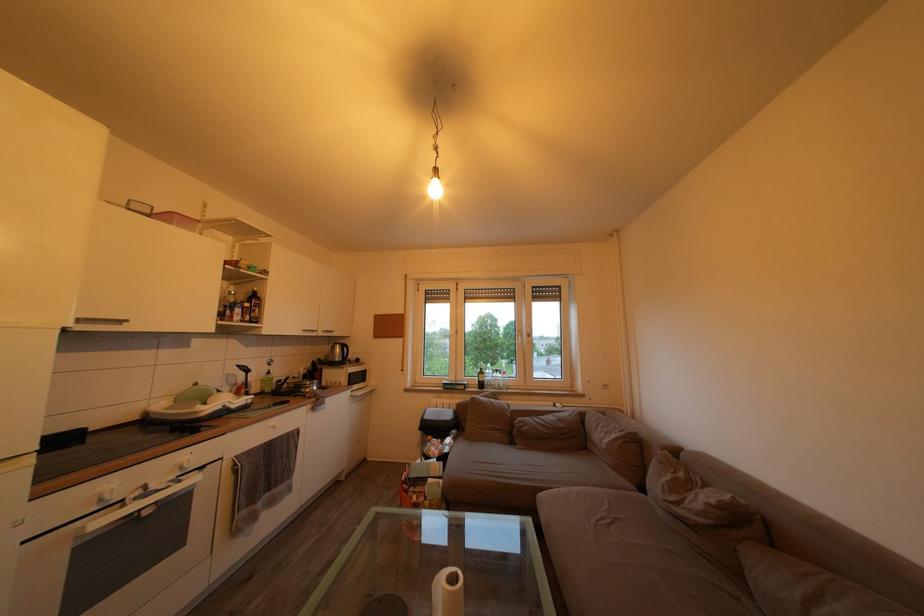
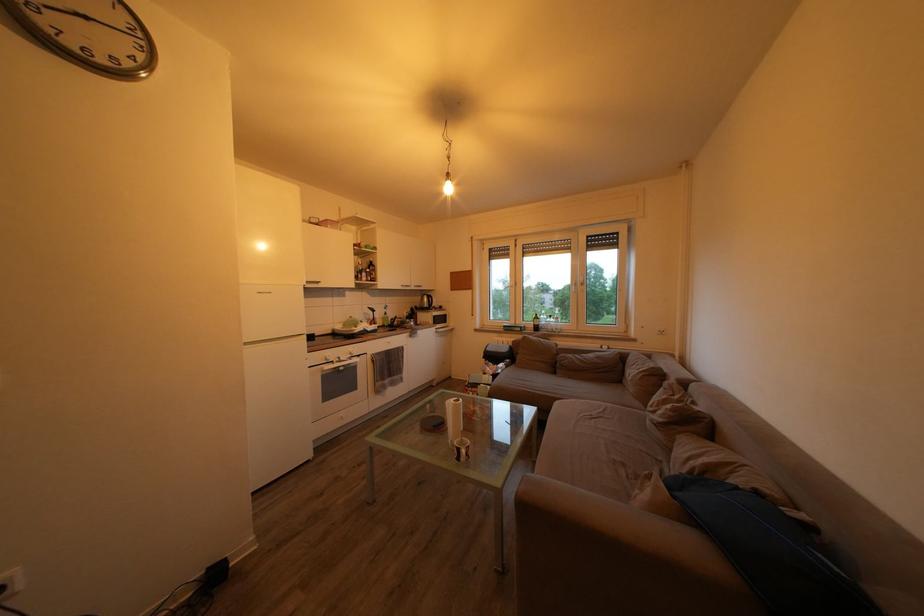
Question: I am providing you with two images of the same scene from different viewpoints. After the viewpoint changes to image2, which objects are now occluded?

Choices:
 (A) oven door handle
 (B) sofa sitting surface
 (C) silver cabinet handle
 (D) none of these

Answer: (D)